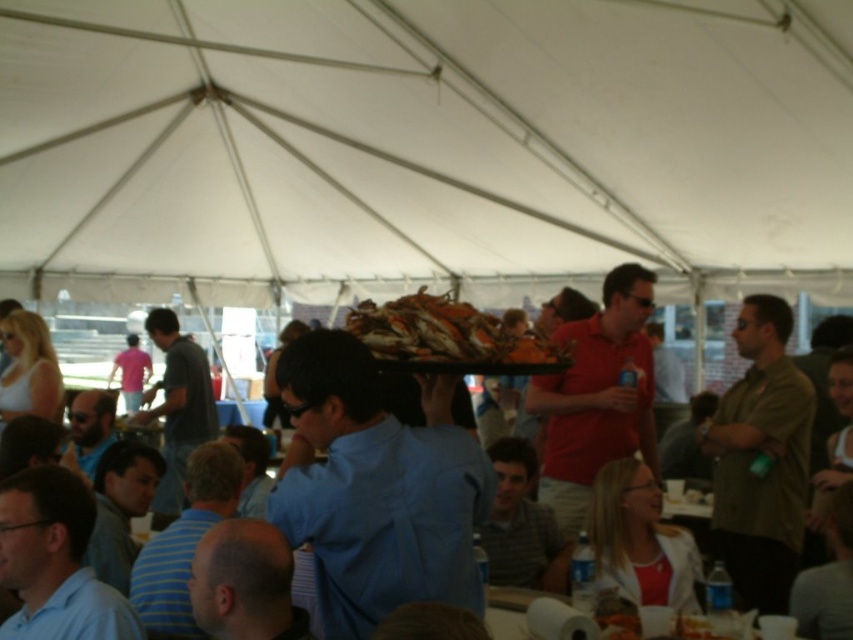
In the scene shown: You are standing at the entrance of the tent and see both the green matte shirt at center and the orange shellfish at center. Which object is closer to you?

The green matte shirt at center is closer to you because it is further to the viewer than the orange shellfish at center.